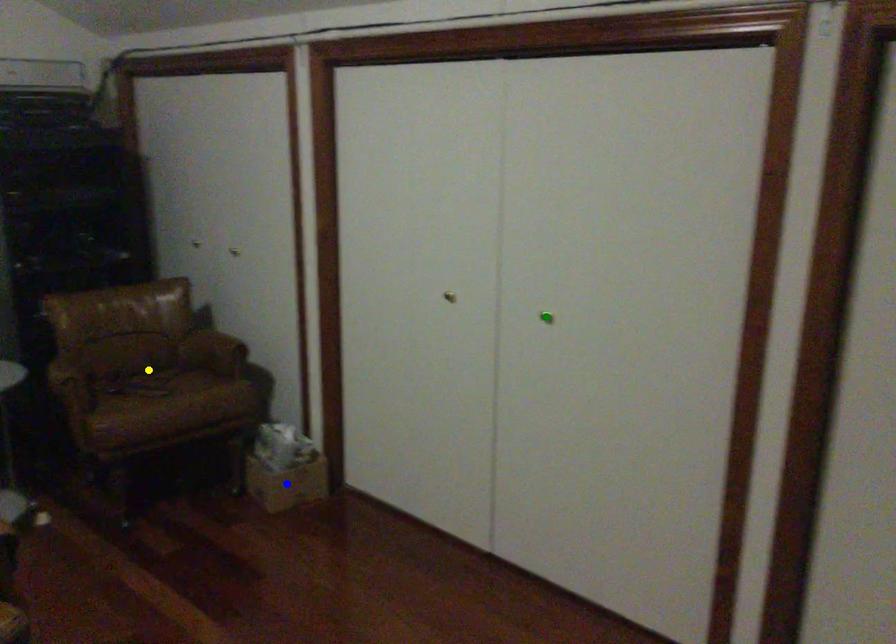
Based on the photo, order these from nearest to farthest:
yellow point, green point, blue point

green point < blue point < yellow point